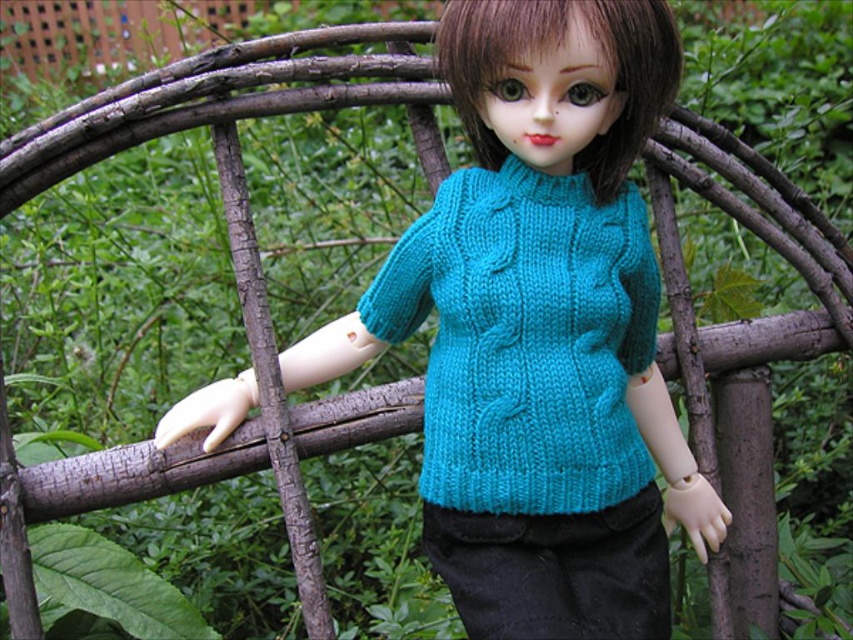
The user is trying to determine which sweater is wider between the teal knitted sweater at center and the turquoise knitted sweater at center. Which one is wider?

The teal knitted sweater at center is wider than the turquoise knitted sweater at center according to the description.

You are a fashion designer observing the doll in the scene. You notice two sweaters on the doll. Which sweater, the teal knitted sweater at center or the turquoise knitted sweater at center, is taller?

The teal knitted sweater at center is much taller than the turquoise knitted sweater at center.